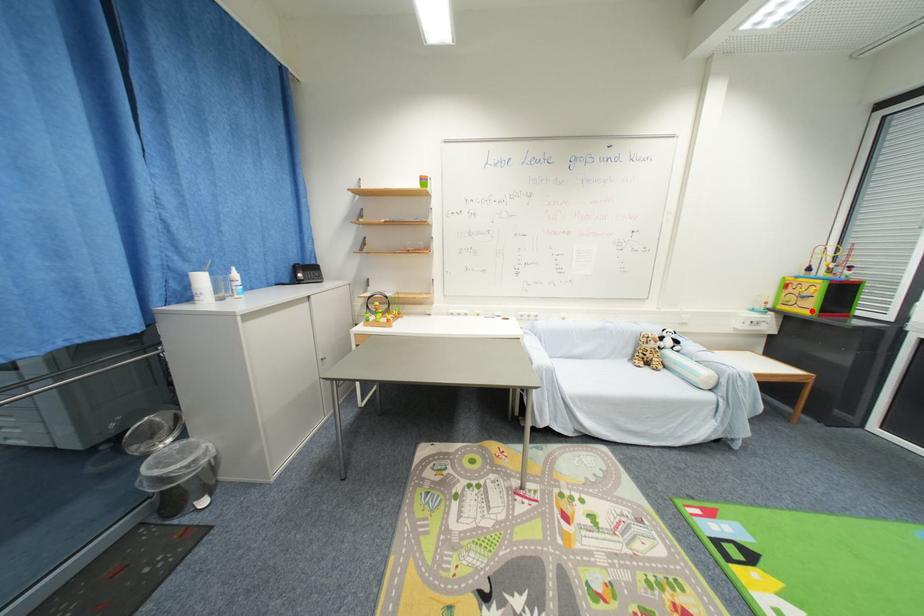
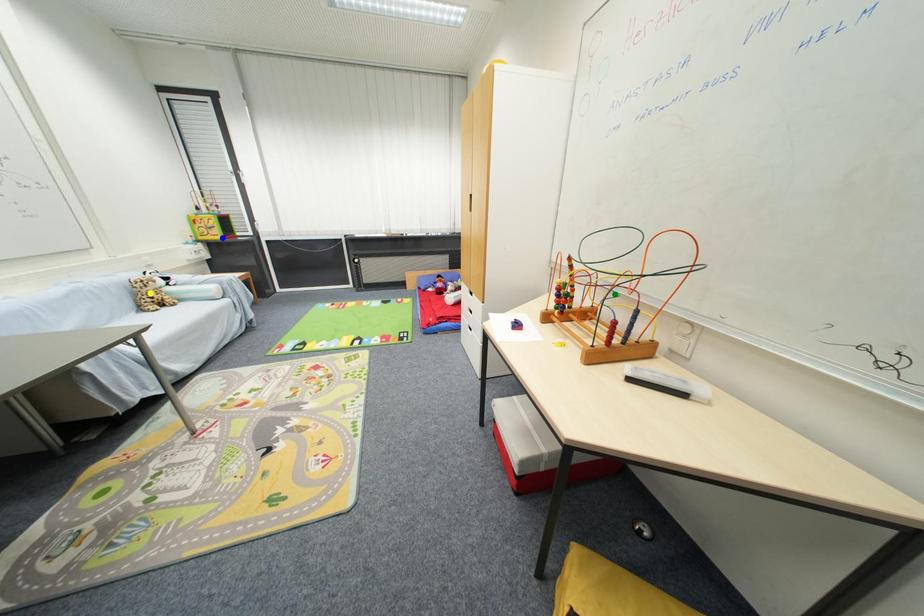
Question: I am providing you with two images of the same scene from different viewpoints. A red point is marked on the first image. You are given multiple points on the second image. Can you choose the point in image 2 that corresponds to the point in image 1?

Choices:
 (A) yellow point
 (B) blue point
 (C) green point

Answer: (B)